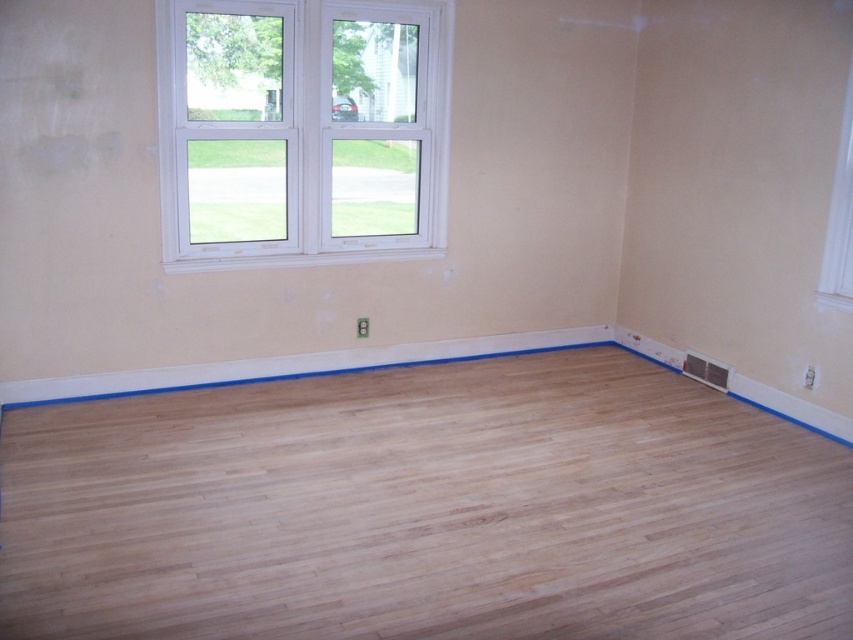
You are a painter standing in the room and need to move a ladder from the natural wood floor at center to the white plastic window at upper left. Can you move the ladder without it hitting anything, considering the ladder is 1.6 meters long?

The distance between the natural wood floor at center and the white plastic window at upper left is 1.58 meters. Since the ladder is 1.6 meters long, which is slightly longer than the distance, the ladder may hit something if moved directly between them. You might need to adjust the path or use a shorter ladder.

You are standing at the entrance of the room and want to walk towards the natural wood floor at center. Which direction should you move relative to the white plastic window at upper left?

You should move to the right of the white plastic window at upper left because the natural wood floor at center is located to the right of it.